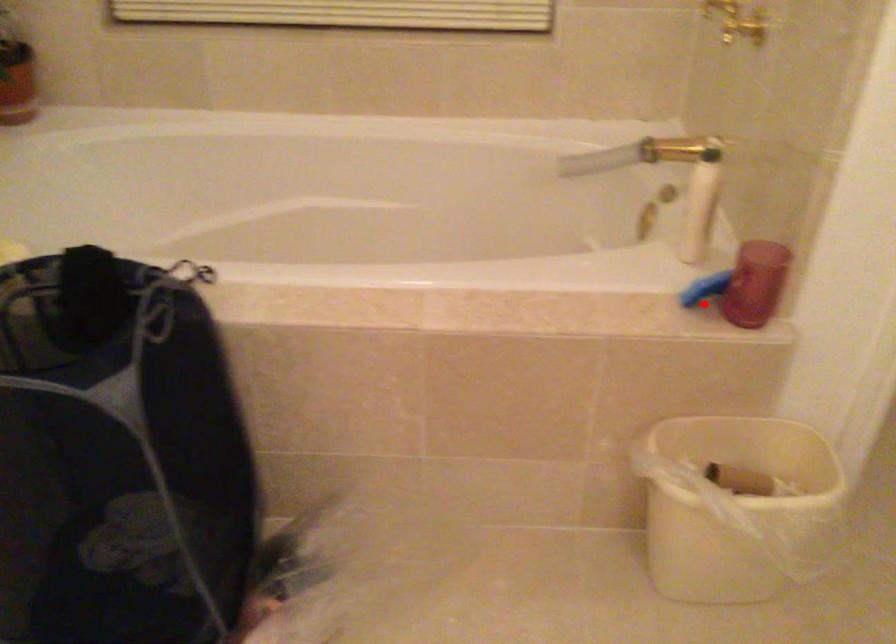
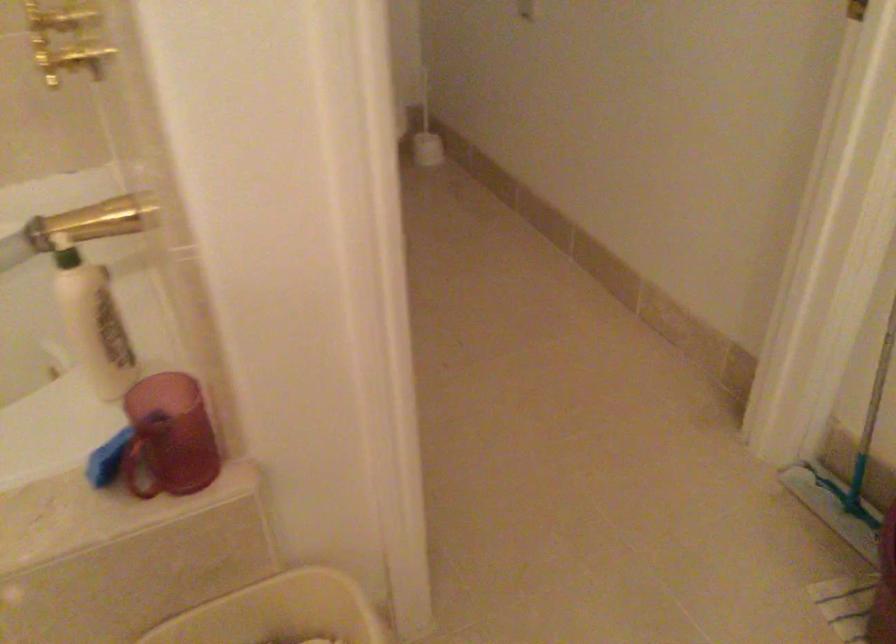
Question: I am providing you with two images of the same scene from different viewpoints. In image1, a red point is highlighted. Considering the same 3D point in image2, which of the following is correct?

Choices:
 (A) It is closer
 (B) It is farther

Answer: (A)